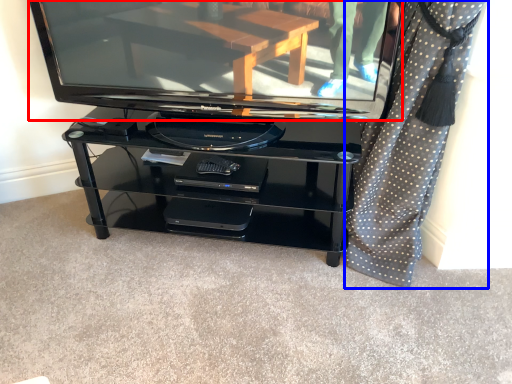
Question: Which point is further to the camera, television (highlighted by a red box) or curtain (highlighted by a blue box)?

Choices:
 (A) television
 (B) curtain

Answer: (A)